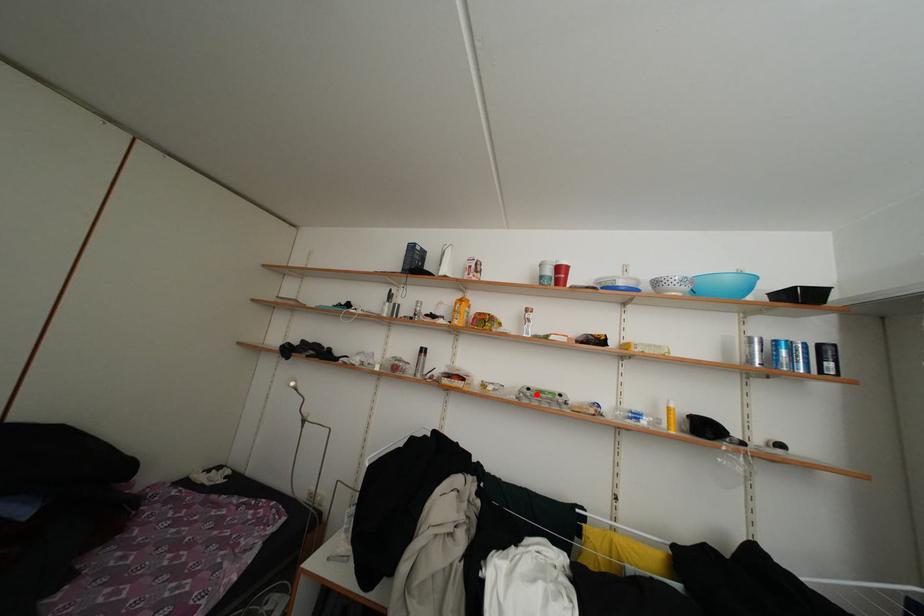
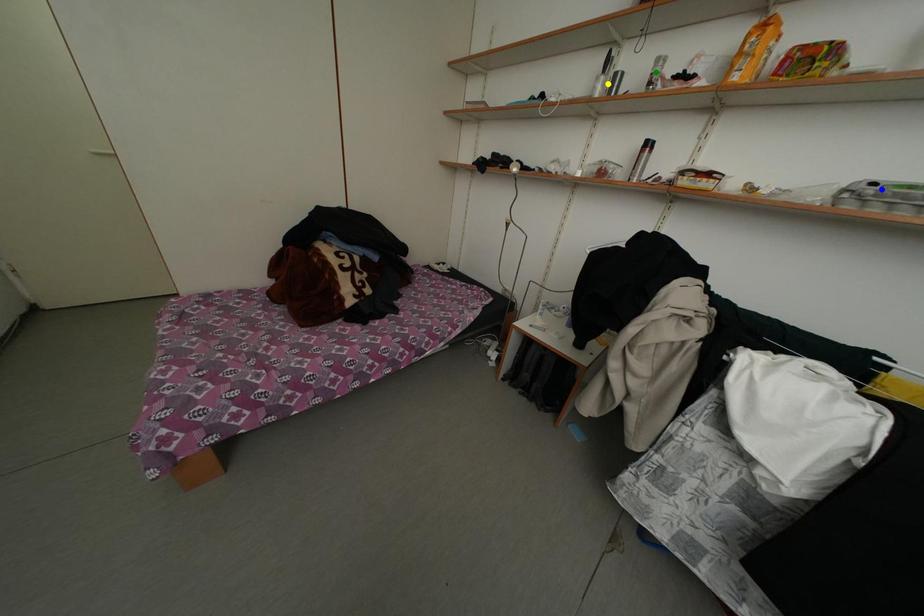
Question: I am providing you with two images of the same scene from different viewpoints. A red point is marked on the first image. You are given multiple points on the second image. Which mark in image 2 goes with the point in image 1?

Choices:
 (A) yellow point
 (B) blue point
 (C) green point

Answer: (B)